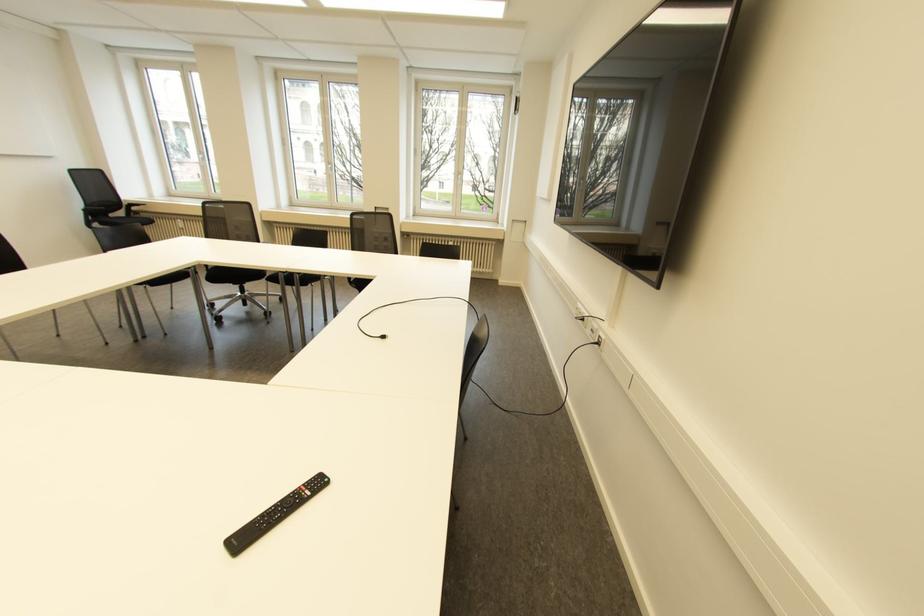
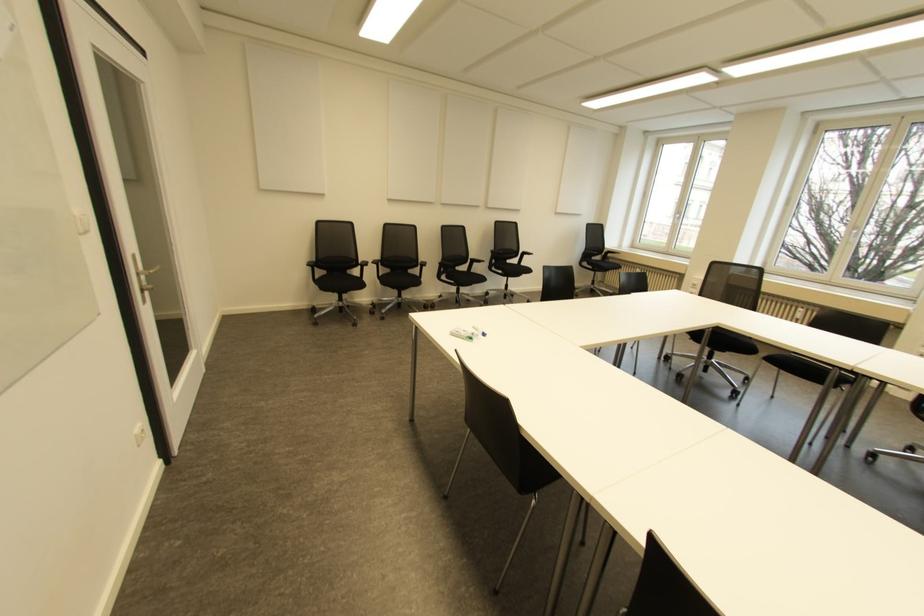
Locate, in the second image, the point that corresponds to the point at 142,215 in the first image.

(610, 261)